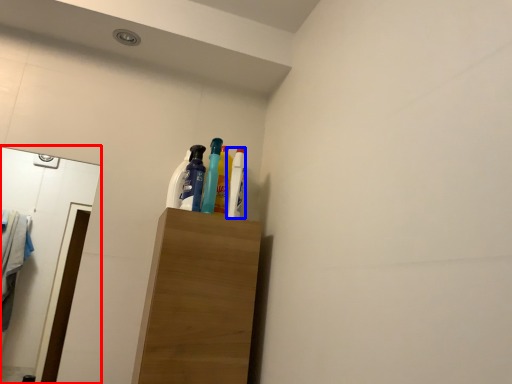
Question: Which object appears farthest to the camera in this image, mirror (highlighted by a red box) or bottle (highlighted by a blue box)?

Choices:
 (A) mirror
 (B) bottle

Answer: (B)